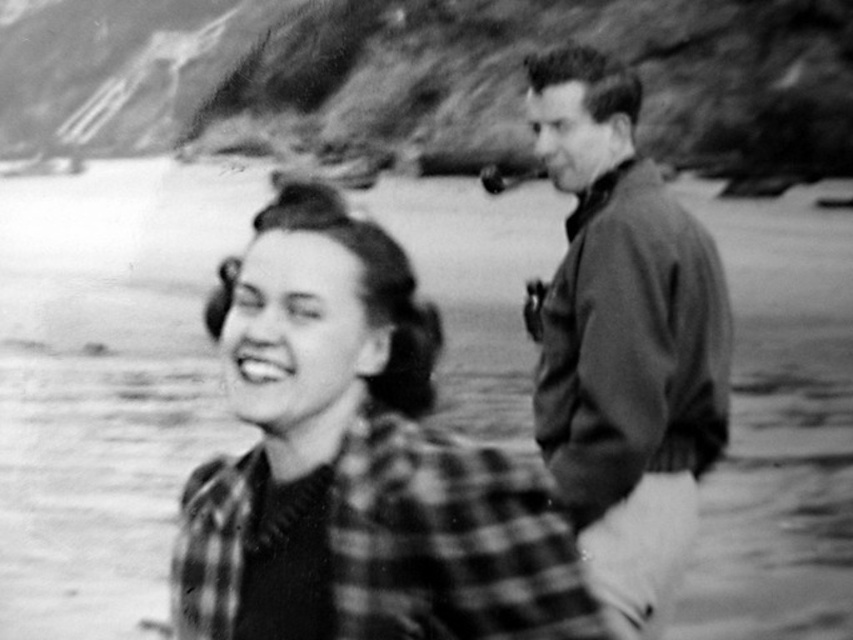
You are a photographer adjusting your camera to focus on the plaid fabric shirt at center and the dark brown leather jacket at right. Which object should you focus on first to ensure it appears sharp in the photo?

The plaid fabric shirt at center should be focused on first because it is closer to the viewer than the dark brown leather jacket at right, so focusing on it ensures it will be sharp while the jacket may appear slightly out of focus due to depth of field.

Based on the scene description, which object is positioned lower in the image? The plaid fabric shirt at center or the dark brown leather jacket at right?

The plaid fabric shirt at center is positioned below dark brown leather jacket at right, so it is lower in the image.